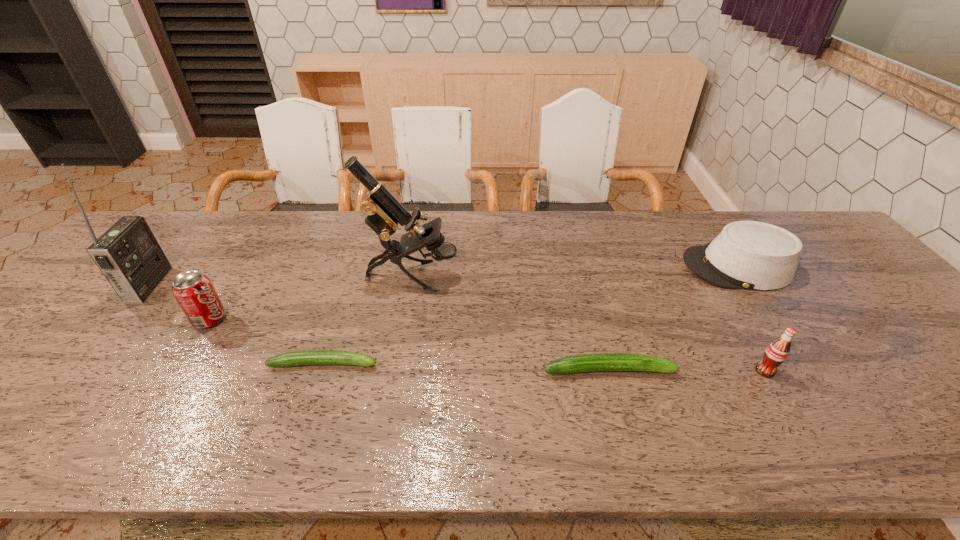
In order to click on zucchini present at the near edge in this screenshot , I will do `click(604, 361)`.

This screenshot has height=540, width=960. In order to click on soda that is at the near edge in this screenshot , I will do `click(776, 353)`.

Identify the location of object situated at the left edge. The image size is (960, 540). (128, 254).

In the image, there is a desktop. Identify the location of vacant space at the far edge. (292, 230).

This screenshot has width=960, height=540. Identify the location of vacant space at the near edge of the desktop. (562, 387).

In the image, there is a desktop. Identify the location of vacant space at the near left corner. The image size is (960, 540). (12, 397).

Where is `free space between the nearer soda and the microscope`? The image size is (960, 540). free space between the nearer soda and the microscope is located at coordinates pos(588,323).

Image resolution: width=960 pixels, height=540 pixels. Find the location of `vacant region between the right zucchini and the microscope`. vacant region between the right zucchini and the microscope is located at coordinates (511, 323).

Locate an element on the screen. The width and height of the screenshot is (960, 540). free space between the microscope and the right zucchini is located at coordinates (511, 323).

Where is `vacant area that lies between the sixth object from right to left and the sixth tallest object`? The image size is (960, 540). vacant area that lies between the sixth object from right to left and the sixth tallest object is located at coordinates (409, 345).